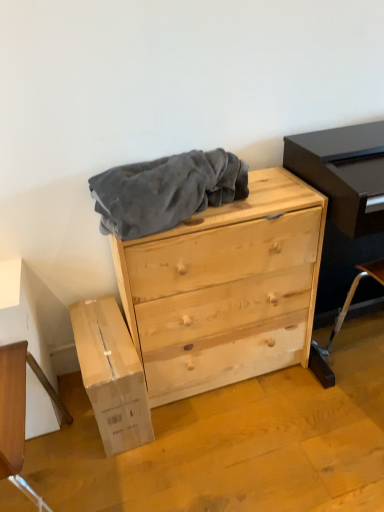
You are a GUI agent. You are given a task and a screenshot of the screen. Output one action in this format:
    pyautogui.click(x=<x>, y=<y>)
    Task: Click on the vacant space to the left of matte black entertainment center at right
    This screenshot has width=384, height=512.
    Given the screenshot: What is the action you would take?
    pyautogui.click(x=310, y=403)